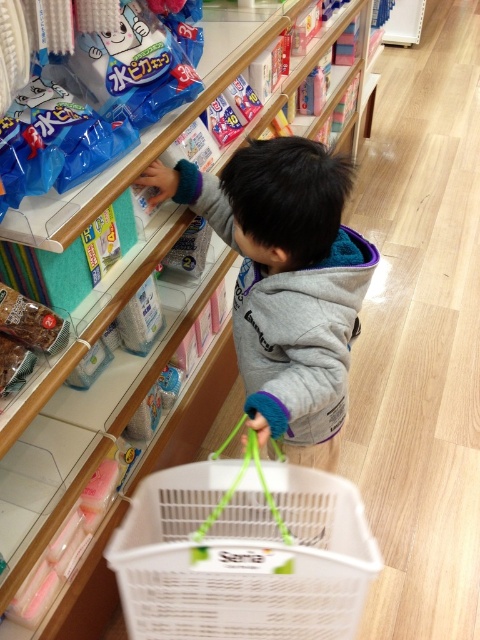
Measure the distance between point (297,500) and camera.

Point (297,500) and camera are 3.41 feet apart from each other.

Which of these two, white plastic basket at lower center or brown textured snack at lower left, stands taller?

white plastic basket at lower center is taller.

Who is more distant from viewer, (255, 588) or (9, 310)?

Positioned behind is point (9, 310).

Find the location of a particular element. white plastic basket at lower center is located at coordinates (243, 556).

Is gray fleece sweatshirt at center wider than brown textured snack at lower left?

Correct, the width of gray fleece sweatshirt at center exceeds that of brown textured snack at lower left.

Who is more forward, (347, 241) or (41, 342)?

Point (41, 342)

Is point (282, 387) positioned in front of point (60, 326)?

Yes, point (282, 387) is in front of point (60, 326).

The width and height of the screenshot is (480, 640). Identify the location of gray fleece sweatshirt at center. (301, 339).

Who is more distant from viewer, (179, 586) or (322, 387)?

The point (322, 387) is more distant.

How distant is white plastic basket at lower center from gray fleece sweatshirt at center?

10.96 inches

I want to click on white plastic basket at lower center, so click(243, 556).